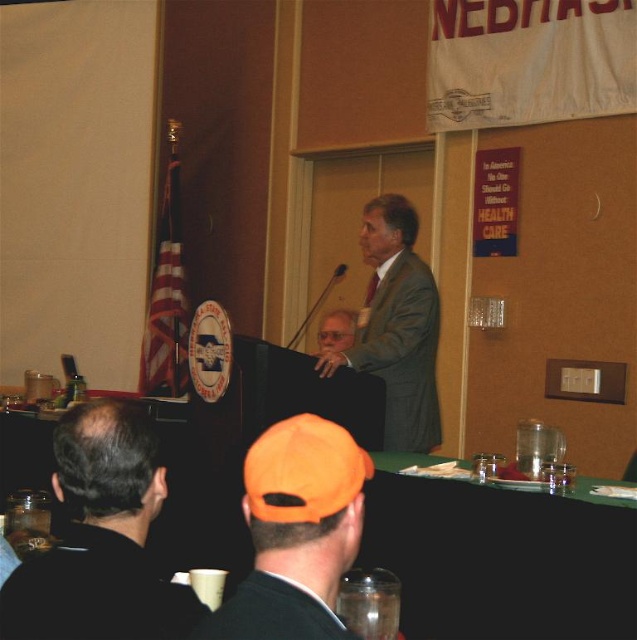
Is point (103, 509) positioned before point (380, 324)?

Yes, point (103, 509) is in front of point (380, 324).

Which is below, black fabric jacket at lower left or matte gray suit at center?

black fabric jacket at lower left is lower down.

Who is more distant from viewer, (138, 624) or (431, 362)?

The point (431, 362) is more distant.

Identify the location of black fabric jacket at lower left. (101, 540).

Does green fabric table at lower center come behind black matte suit at lower center?

Yes, green fabric table at lower center is behind black matte suit at lower center.

Which is below, green fabric table at lower center or black matte suit at lower center?

green fabric table at lower center is below.

Which is in front, point (454, 540) or point (282, 625)?

Point (282, 625)

Where is `green fabric table at lower center`? green fabric table at lower center is located at coordinates (499, 557).

Who is positioned more to the left, black matte suit at lower left or black matte suit at lower center?

Positioned to the left is black matte suit at lower left.

Between black matte suit at lower left and black matte suit at lower center, which one is positioned lower?

Positioned lower is black matte suit at lower left.

Where is `black matte suit at lower left`? This screenshot has width=637, height=640. black matte suit at lower left is located at coordinates (96, 593).